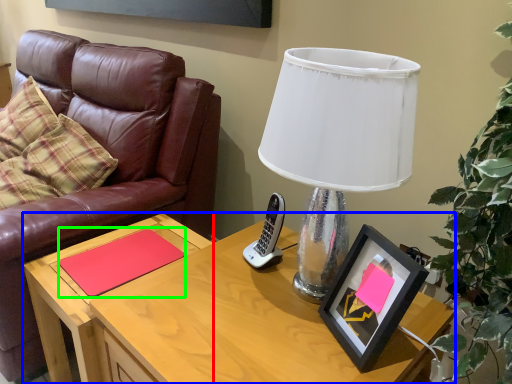
Question: Based on their relative distances, which object is farther from side table (highlighted by a red box)? Choose from desk (highlighted by a blue box) and notepad (highlighted by a green box).

Choices:
 (A) desk
 (B) notepad

Answer: (A)